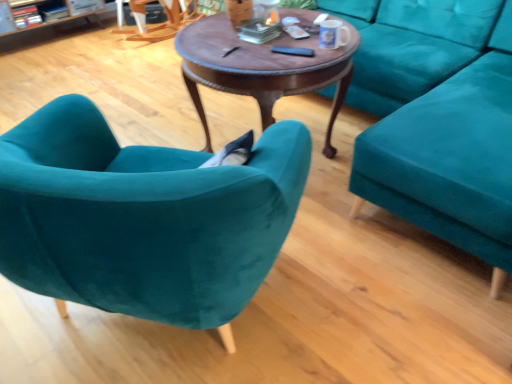
This screenshot has width=512, height=384. Find the location of `spots to the right of black matte remote control at center, which is the first remote control in front-to-back order`. spots to the right of black matte remote control at center, which is the first remote control in front-to-back order is located at coordinates (317, 56).